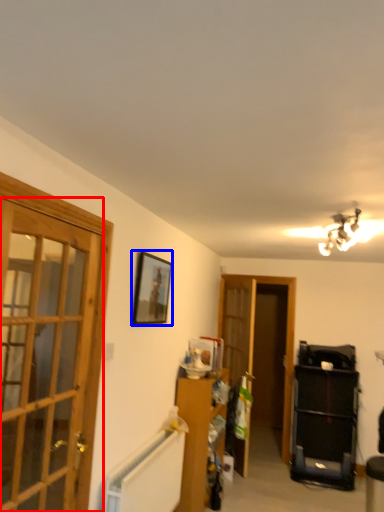
Question: Among these objects, which one is nearest to the camera, door (highlighted by a red box) or picture frame (highlighted by a blue box)?

Choices:
 (A) door
 (B) picture frame

Answer: (A)